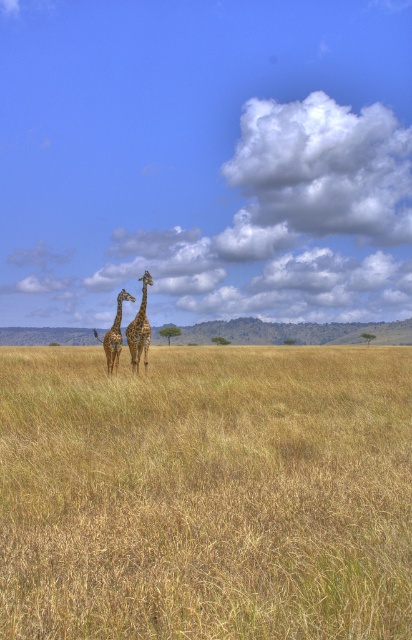
You are a photographer trying to capture the dry grass at center and the spotted brown giraffe at center in a single wide shot. Based on the scene, which object will occupy more space in your photo?

The dry grass at center will occupy more space in the photo because its width is larger than that of the spotted brown giraffe at center.

You are standing at the origin point of the image coordinate system. You want to locate the spotted brown giraffe at center. What are its coordinates?

The coordinates of the spotted brown giraffe at center are at point (140, 328).